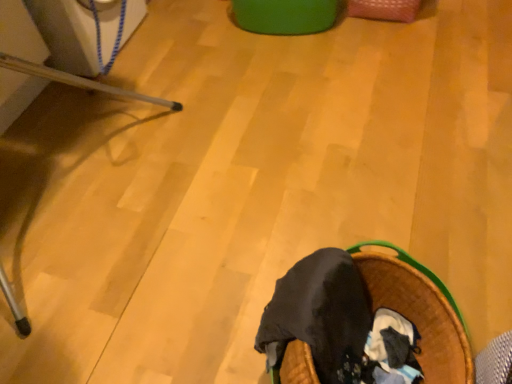
At what (x,y) coordinates should I click in order to perform the action: click on free space to the back side of dark fabric laundry basket at lower center. Please return your answer as a coordinate pair (x, y). Looking at the image, I should click on (316, 219).